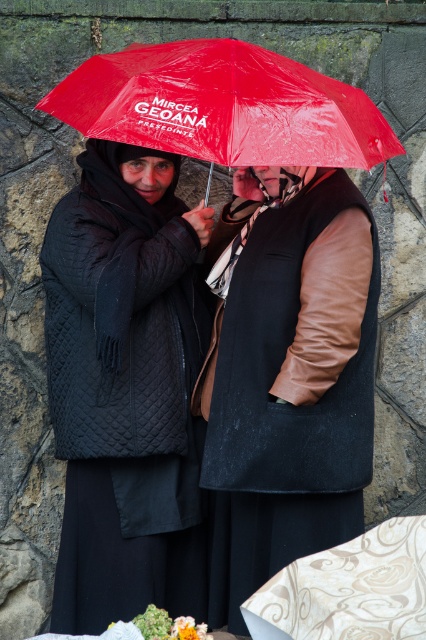
Is the position of matte black coat at center less distant than that of red plastic umbrella at upper center?

No, matte black coat at center is behind red plastic umbrella at upper center.

Can you confirm if matte black coat at center is positioned below red plastic umbrella at upper center?

Indeed, matte black coat at center is positioned under red plastic umbrella at upper center.

Is point (226, 604) positioned before point (169, 61)?

That is False.

You are a GUI agent. You are given a task and a screenshot of the screen. Output one action in this format:
    pyautogui.click(x=<x>, y=<y>)
    Task: Click on the matte black coat at center
    This screenshot has height=640, width=426.
    Given the screenshot: What is the action you would take?
    pyautogui.click(x=247, y=419)